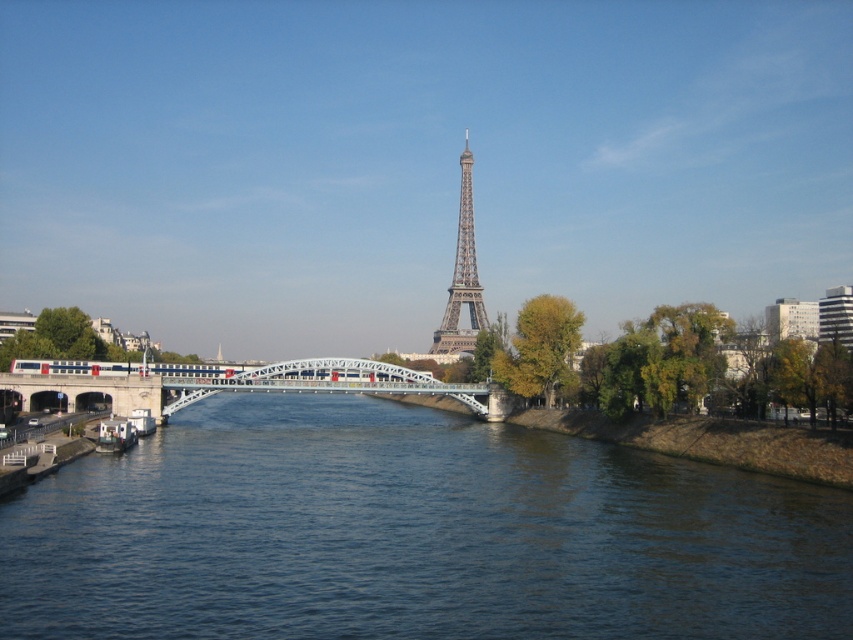
Identify the location of blue water at center. The height and width of the screenshot is (640, 853). (413, 534).

Is point (123, 634) in front of point (349, 381)?

Yes.

Find the location of a particular element. This screenshot has width=853, height=640. blue water at center is located at coordinates (413, 534).

Looking at this image, can you confirm if metallic bridge at center is shorter than metallic lattice tower at center?

Yes.

What do you see at coordinates (227, 381) in the screenshot?
I see `metallic bridge at center` at bounding box center [227, 381].

Does point (360, 372) come in front of point (457, 330)?

Yes, point (360, 372) is in front of point (457, 330).

Where is `metallic bridge at center`? metallic bridge at center is located at coordinates (227, 381).

Is blue water at center above metallic lattice tower at center?

No, blue water at center is not above metallic lattice tower at center.

Between point (610, 480) and point (480, 328), which one is positioned in front?

Positioned in front is point (610, 480).

Between point (747, 481) and point (463, 216), which one is positioned behind?

Point (463, 216)

At what (x,y) coordinates should I click in order to perform the action: click on blue water at center. Please return your answer as a coordinate pair (x, y). The image size is (853, 640). Looking at the image, I should click on (413, 534).